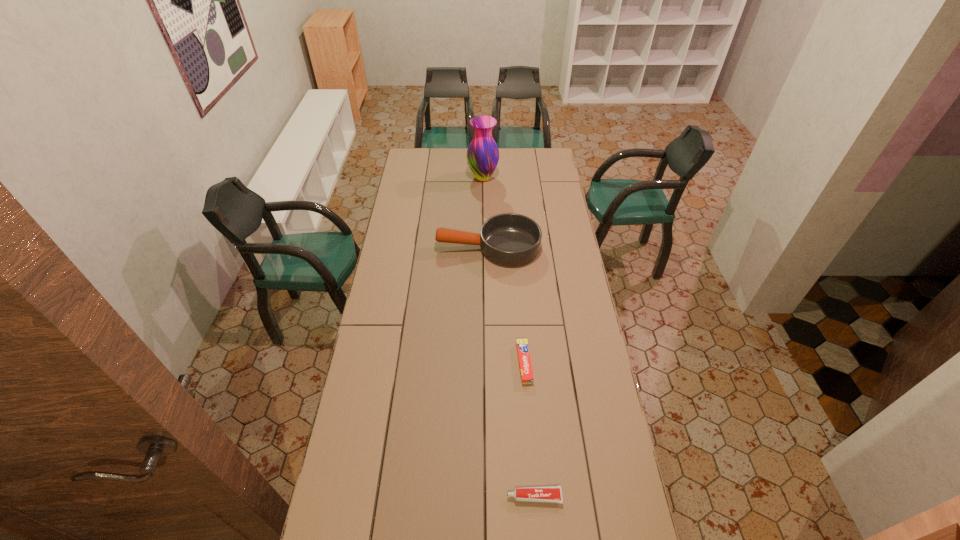
Locate an element on the screen. The height and width of the screenshot is (540, 960). vacant area that satisfies the following two spatial constraints: 1. on the handle side of the pan; 2. on the left side of the third farthest object is located at coordinates (491, 363).